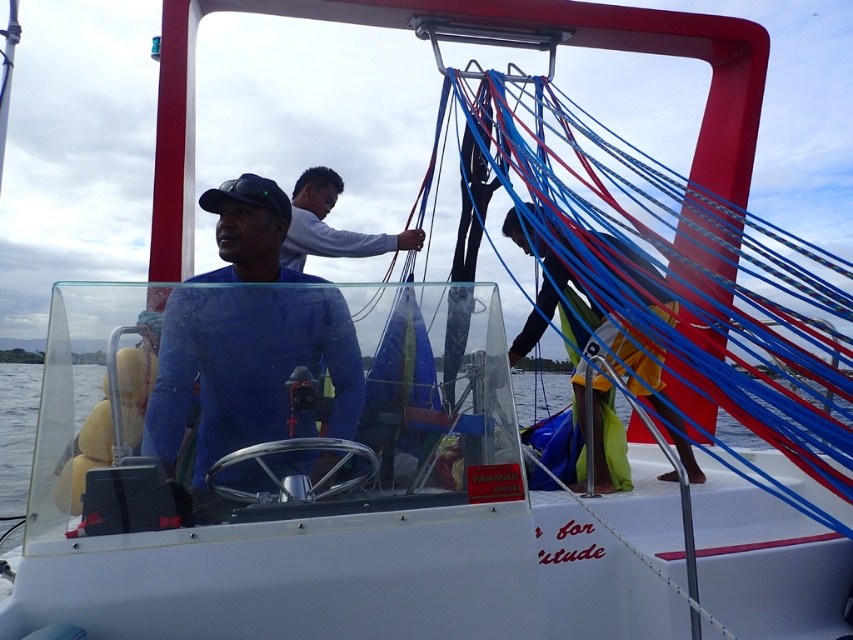
Who is higher up, yellow fabric at right or white matte shirt at center?

white matte shirt at center is above.

Between yellow fabric at right and white matte shirt at center, which one has more height?

yellow fabric at right

Where is `yellow fabric at right`? The width and height of the screenshot is (853, 640). yellow fabric at right is located at coordinates (611, 342).

Image resolution: width=853 pixels, height=640 pixels. I want to click on yellow fabric at right, so click(611, 342).

Locate an element on the screen. This screenshot has height=640, width=853. blue matte shirt at center is located at coordinates (248, 339).

Does blue matte shirt at center have a lesser height compared to transparent water at steering wheel left?

Indeed, blue matte shirt at center has a lesser height compared to transparent water at steering wheel left.

Between point (157, 413) and point (553, 381), which one is positioned behind?

Positioned behind is point (553, 381).

Locate an element on the screen. This screenshot has height=640, width=853. blue matte shirt at center is located at coordinates (248, 339).

Who is taller, yellow fabric at right or transparent water at steering wheel left?

With more height is yellow fabric at right.

Consider the image. Is yellow fabric at right above transparent water at steering wheel left?

Yes, yellow fabric at right is above transparent water at steering wheel left.

Where is `yellow fabric at right`? yellow fabric at right is located at coordinates (611, 342).